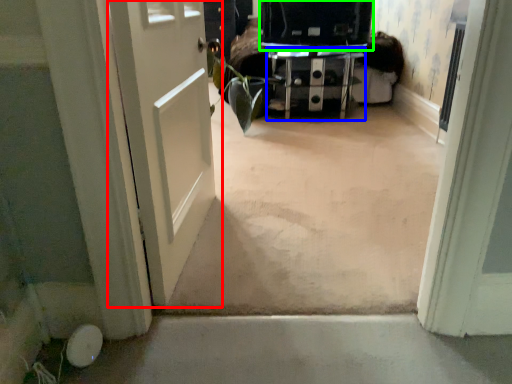
Question: Based on their relative distances, which object is nearer to door (highlighted by a red box)? Choose from furniture (highlighted by a blue box) and back (highlighted by a green box).

Choices:
 (A) furniture
 (B) back

Answer: (B)